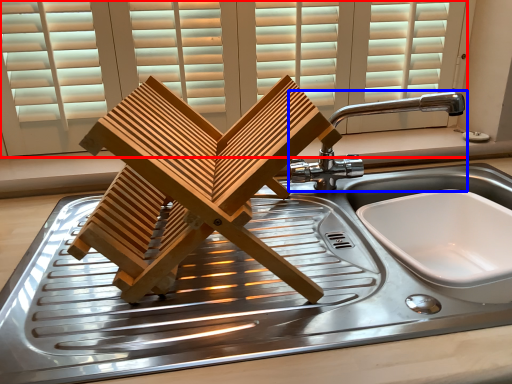
Question: Which object is closer to the camera taking this photo, window (highlighted by a red box) or tap (highlighted by a blue box)?

Choices:
 (A) window
 (B) tap

Answer: (B)